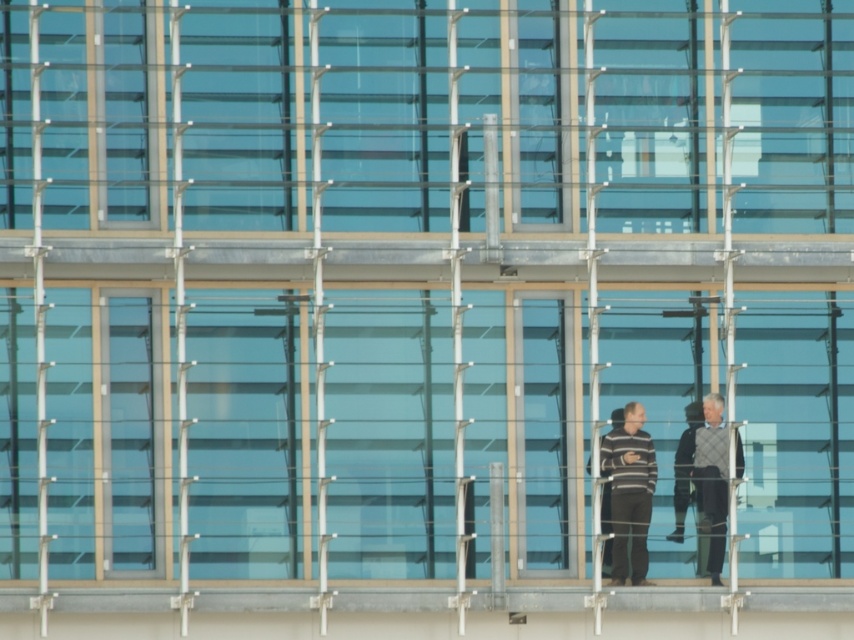
Question: Which of these objects is positioned closest to the striped sweater at center?

Choices:
 (A) knitted sweater at center
 (B) gray wool sweater at center

Answer: (B)

Question: Is striped sweater at center closer to camera compared to knitted sweater at center?

Choices:
 (A) yes
 (B) no

Answer: (B)

Question: Can you confirm if striped sweater at center is positioned to the right of gray wool sweater at center?

Choices:
 (A) yes
 (B) no

Answer: (B)

Question: Which point is closer to the camera taking this photo?

Choices:
 (A) (718, 433)
 (B) (654, 474)
 (C) (689, 460)

Answer: (A)

Question: Which of the following is the farthest from the observer?

Choices:
 (A) striped sweater at center
 (B) knitted sweater at center
 (C) gray wool sweater at center

Answer: (C)

Question: Can you confirm if knitted sweater at center is positioned to the right of gray wool sweater at center?

Choices:
 (A) yes
 (B) no

Answer: (A)